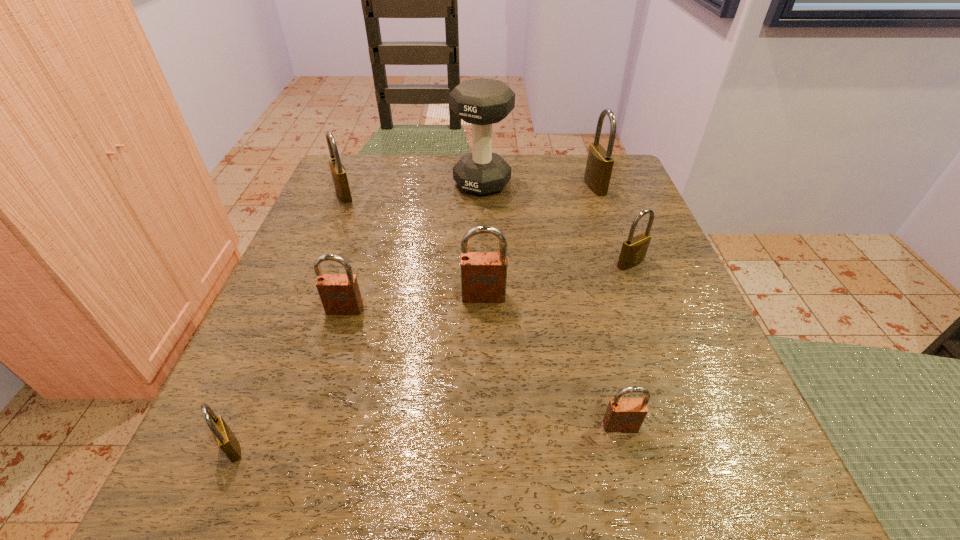
Image resolution: width=960 pixels, height=540 pixels. What are the coordinates of `the third farthest padlock` in the screenshot? It's located at (634, 249).

You are a GUI agent. You are given a task and a screenshot of the screen. Output one action in this format:
    pyautogui.click(x=<x>, y=<y>)
    Task: Click on the third object from right to left
    The width and height of the screenshot is (960, 540).
    Given the screenshot: What is the action you would take?
    pyautogui.click(x=623, y=415)

Where is `the nearest brown padlock`? The image size is (960, 540). the nearest brown padlock is located at coordinates (623, 415).

In order to click on the smallest brass padlock in this screenshot , I will do `click(224, 437)`.

At what (x,y) coordinates should I click in order to perform the action: click on free space located 0.360m on the front of the dumbbell. Please return your answer as a coordinate pair (x, y). This screenshot has height=540, width=960. Looking at the image, I should click on (483, 321).

In order to click on free space located 0.330m on the left of the seventh shortest object in this screenshot , I will do `click(444, 186)`.

Locate an element on the screen. The height and width of the screenshot is (540, 960). free spot located 0.370m on the right of the second biggest brass padlock is located at coordinates (518, 194).

At what (x,y) coordinates should I click in order to perform the action: click on free spot located 0.290m on the front-facing side of the fourth farthest padlock. Please return your answer as a coordinate pair (x, y). The image size is (960, 540). Looking at the image, I should click on (485, 475).

Where is `vacant space located 0.150m on the front-facing side of the sixth farthest object`? vacant space located 0.150m on the front-facing side of the sixth farthest object is located at coordinates (319, 394).

Where is `free spot located on the front of the third farthest padlock`? This screenshot has width=960, height=540. free spot located on the front of the third farthest padlock is located at coordinates coord(660,339).